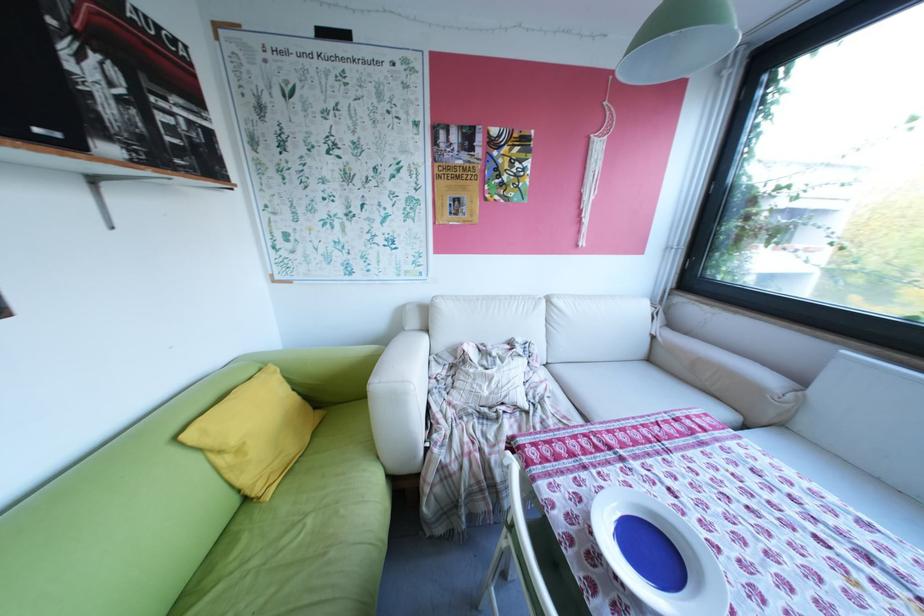
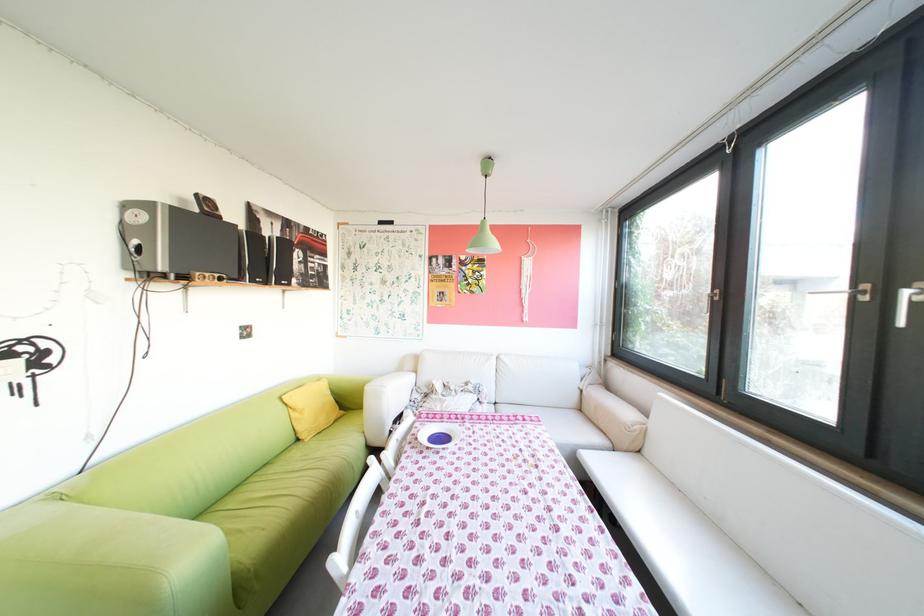
In the second image, find the point that corresponds to point (637, 445) in the first image.

(484, 419)